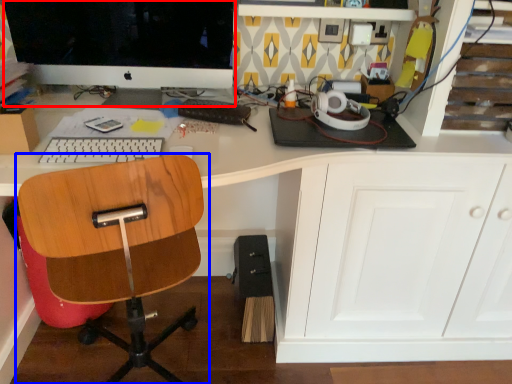
Question: Which object appears closest to the camera in this image, computer monitor (highlighted by a red box) or chair (highlighted by a blue box)?

Choices:
 (A) computer monitor
 (B) chair

Answer: (B)